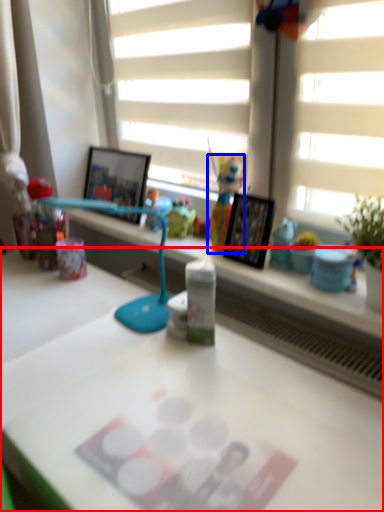
Question: Which object is further to the camera taking this photo, desk (highlighted by a red box) or toy (highlighted by a blue box)?

Choices:
 (A) desk
 (B) toy

Answer: (B)